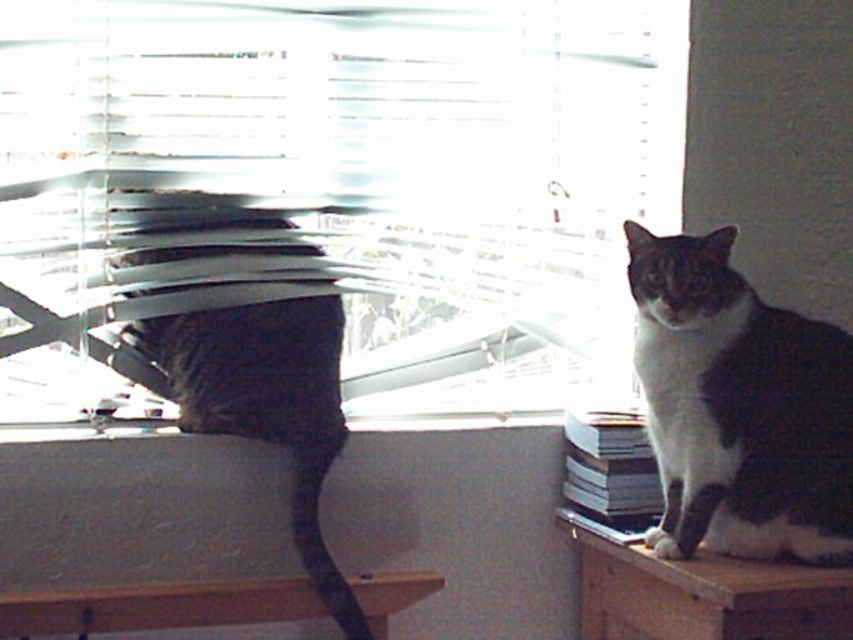
Does dark gray fur cat at left have a larger size compared to wooden table at lower left?

Indeed, dark gray fur cat at left has a larger size compared to wooden table at lower left.

Between point (120, 372) and point (119, 612), which one is positioned behind?

The point (120, 372) is behind.

At what (x,y) coordinates should I click in order to perform the action: click on dark gray fur cat at left. Please return your answer as a coordinate pair (x, y). The width and height of the screenshot is (853, 640). Looking at the image, I should click on (264, 403).

Which of these two, black and white fur cat at right or dark gray fur cat at left, stands taller?

dark gray fur cat at left

Does point (662, 464) lie in front of point (236, 374)?

That is True.

Find the location of a particular element. black and white fur cat at right is located at coordinates (740, 406).

Does white plastic blinds at upper center have a greater height compared to wooden table at right?

Yes.

Is point (381, 54) closer to viewer compared to point (646, 556)?

No, (381, 54) is further to viewer.

The image size is (853, 640). What do you see at coordinates (316, 179) in the screenshot?
I see `white plastic blinds at upper center` at bounding box center [316, 179].

You are a GUI agent. You are given a task and a screenshot of the screen. Output one action in this format:
    pyautogui.click(x=<x>, y=<y>)
    Task: Click on the white plastic blinds at upper center
    Image resolution: width=853 pixels, height=640 pixels.
    Given the screenshot: What is the action you would take?
    pyautogui.click(x=316, y=179)